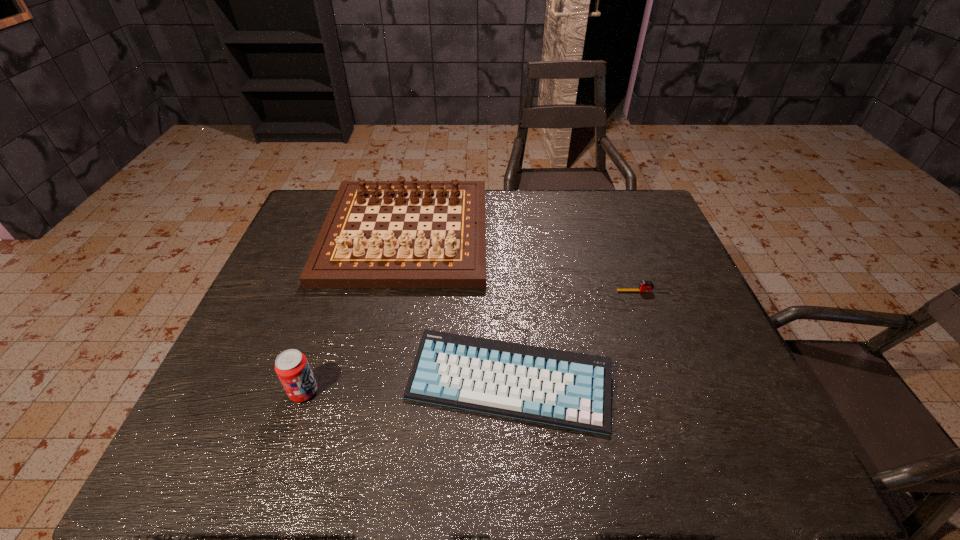
The width and height of the screenshot is (960, 540). In order to click on object that is at the near edge in this screenshot , I will do `click(569, 389)`.

This screenshot has width=960, height=540. I want to click on object present at the left edge, so point(447,253).

At what (x,y) coordinates should I click in order to perform the action: click on object present at the right edge. Please return your answer as a coordinate pair (x, y). The width and height of the screenshot is (960, 540). Looking at the image, I should click on (645, 286).

Locate an element on the screen. Image resolution: width=960 pixels, height=540 pixels. object present at the far left corner is located at coordinates (x=447, y=253).

In the image, there is a desktop. In order to click on vacant space at the far edge in this screenshot , I will do `click(588, 200)`.

Where is `free space at the near edge of the desktop`? The image size is (960, 540). free space at the near edge of the desktop is located at coordinates (342, 458).

Where is `vacant region at the left edge of the desktop`? This screenshot has height=540, width=960. vacant region at the left edge of the desktop is located at coordinates (270, 345).

You are a GUI agent. You are given a task and a screenshot of the screen. Output one action in this format:
    pyautogui.click(x=<x>, y=<y>)
    Task: Click on the vacant space at the far left corner of the desktop
    The width and height of the screenshot is (960, 540).
    Given the screenshot: What is the action you would take?
    pyautogui.click(x=334, y=194)

In the image, there is a desktop. Identify the location of vacant space at the near left corner. (204, 465).

I want to click on free space at the far right corner, so click(624, 208).